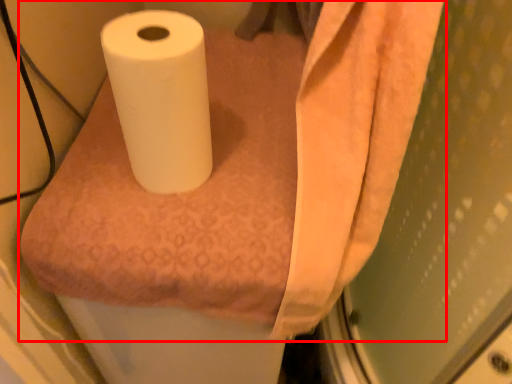
Question: From the image's perspective, considering the relative positions of paper towel (annotated by the red box) and toilet paper in the image provided, where is paper towel (annotated by the red box) located with respect to the staircase?

Choices:
 (A) below
 (B) above

Answer: (A)